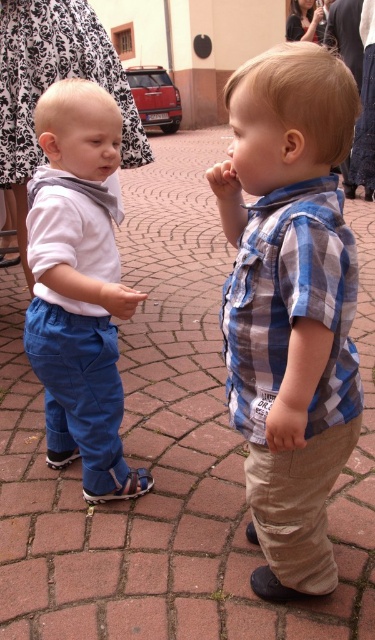
Looking at this image, you are a photographer trying to capture a clear shot of the matte blue pants at left and the brown leather sandal at lower left. Based on their positions, which object should you focus on first to ensure both are in frame?

The matte blue pants at left is above the brown leather sandal at lower left, so you should focus on the matte blue pants at left first to ensure both are in frame.